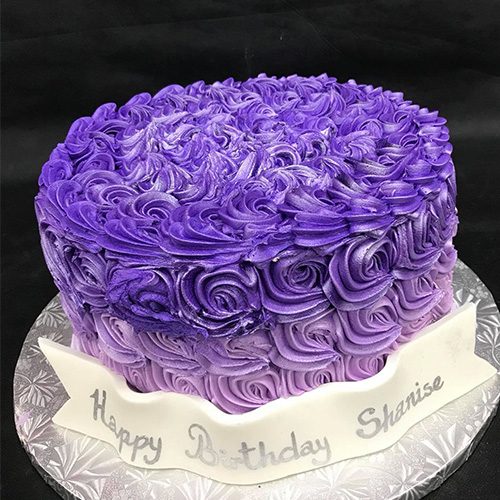
Where is `cake platter`? The image size is (500, 500). cake platter is located at coordinates (350, 498).